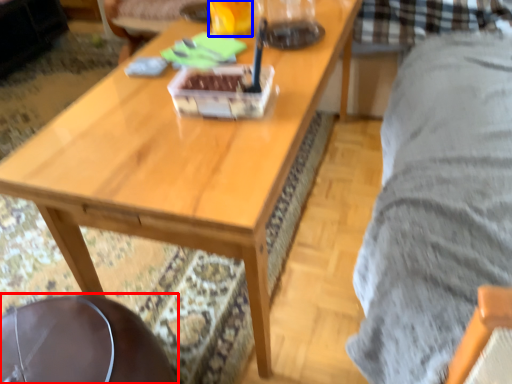
Question: Which point is closer to the camera, swivel chair (highlighted by a red box) or beverage (highlighted by a blue box)?

Choices:
 (A) swivel chair
 (B) beverage

Answer: (A)